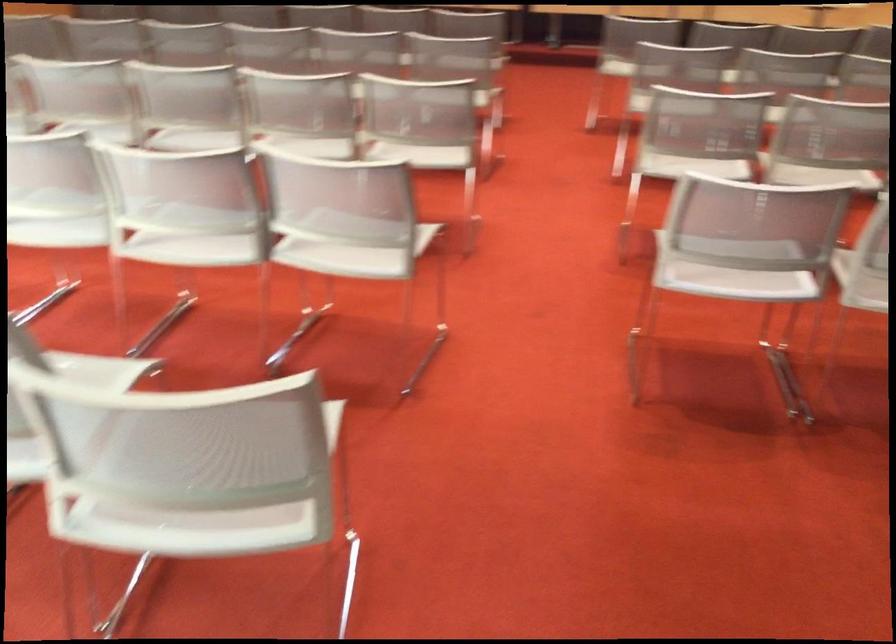
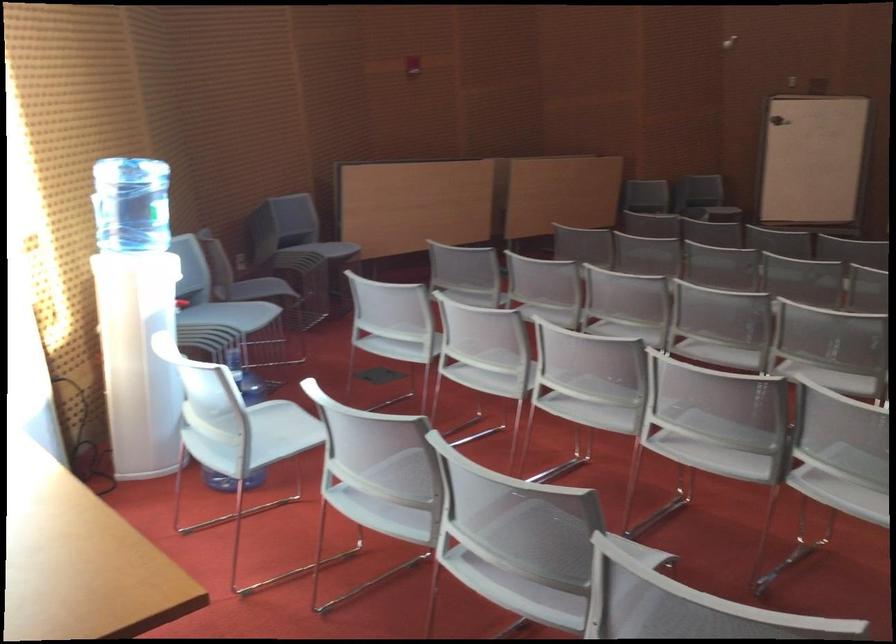
Locate, in the second image, the point that corresponds to pixel 202 245 in the first image.

(716, 453)